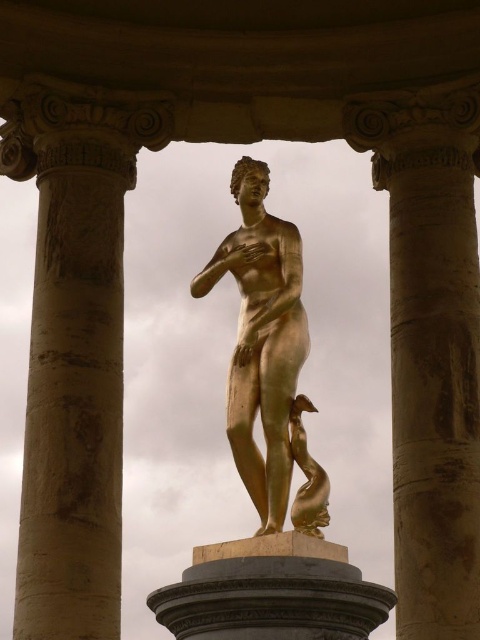
Can you confirm if beige stone column at left is positioned above gold metallic statue at center?

Yes, beige stone column at left is above gold metallic statue at center.

Can you confirm if beige stone column at left is wider than gold metallic statue at center?

Indeed, beige stone column at left has a greater width compared to gold metallic statue at center.

Does point (46, 272) come behind point (299, 497)?

Yes, point (46, 272) is farther from viewer.

At what (x,y) coordinates should I click in order to perform the action: click on beige stone column at left. Please return your answer as a coordinate pair (x, y). This screenshot has height=640, width=480. Looking at the image, I should click on (74, 394).

Between point (115, 394) and point (282, 420), which one is positioned in front?

Positioned in front is point (282, 420).

Between point (106, 577) and point (312, 490), which one is positioned in front?

Positioned in front is point (312, 490).

In order to click on beige stone column at left in this screenshot , I will do `click(74, 394)`.

Is golden polished stone column at center above beige stone column at left?

Correct, golden polished stone column at center is located above beige stone column at left.

Does golden polished stone column at center have a greater height compared to beige stone column at left?

Yes, golden polished stone column at center is taller than beige stone column at left.

Does point (394, 422) come closer to viewer compared to point (101, 376)?

That is False.

Where is `golden polished stone column at center`? The width and height of the screenshot is (480, 640). golden polished stone column at center is located at coordinates (431, 344).